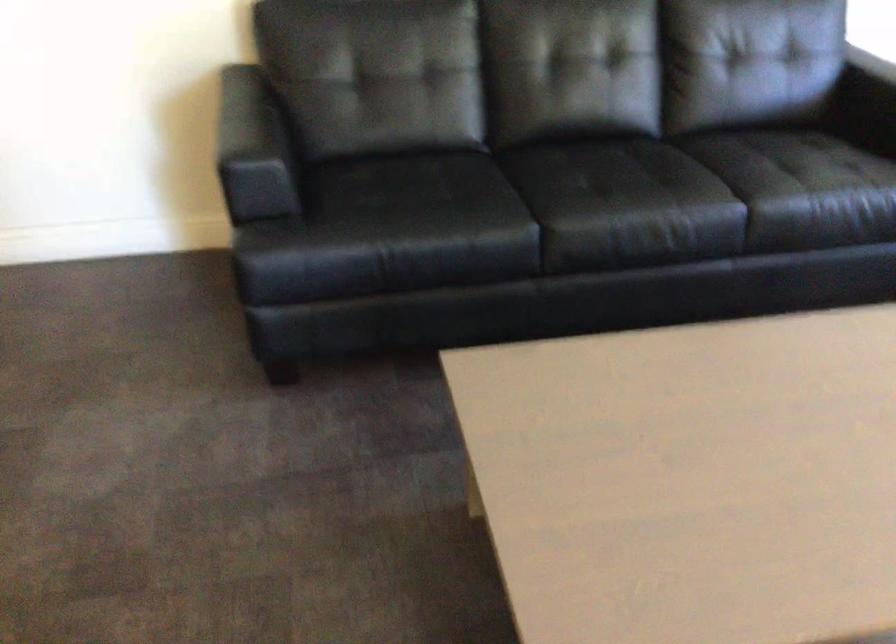
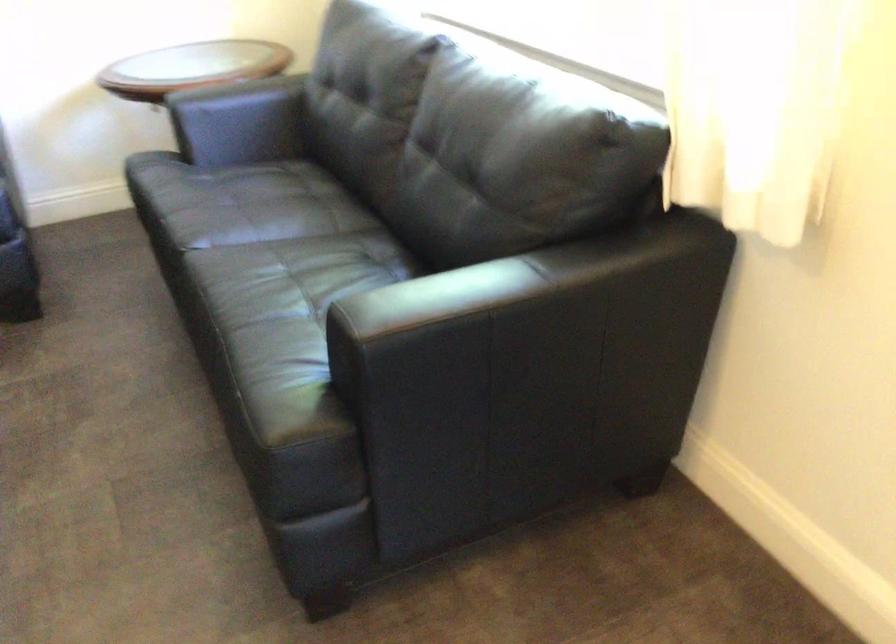
Question: In a continuous first-person perspective shot, in which direction is the camera moving?

Choices:
 (A) Left
 (B) Right
 (C) Forward
 (D) Backward

Answer: (B)